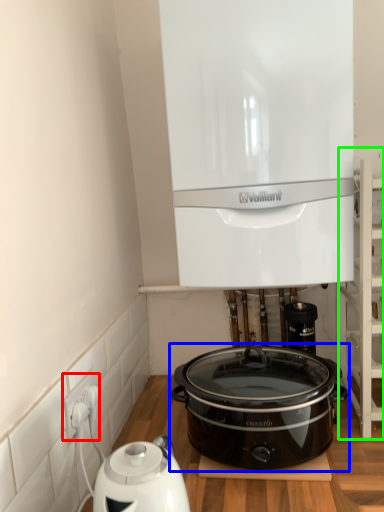
Question: Which object is the closest to the electric outlet (highlighted by a red box)? Choose among these: slow cooker (highlighted by a blue box) or shelf (highlighted by a green box).

Choices:
 (A) slow cooker
 (B) shelf

Answer: (A)